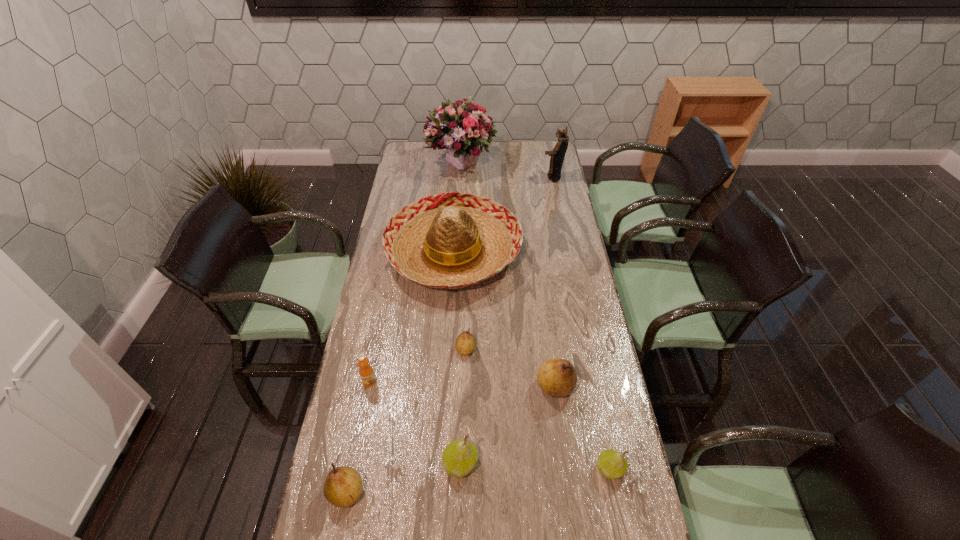
Find the location of a particular element. Image resolution: width=960 pixels, height=540 pixels. figurine positioned at the right edge is located at coordinates (558, 153).

You are a GUI agent. You are given a task and a screenshot of the screen. Output one action in this format:
    pyautogui.click(x=<x>, y=<y>)
    Task: Click on the object present at the far left corner
    
    Given the screenshot: What is the action you would take?
    pyautogui.click(x=460, y=127)

At what (x,y) coordinates should I click in order to perform the action: click on vacant area at the far edge. Please return your answer as a coordinate pair (x, y). This screenshot has width=960, height=540. Looking at the image, I should click on (521, 159).

You are a GUI agent. You are given a task and a screenshot of the screen. Output one action in this format:
    pyautogui.click(x=<x>, y=<y>)
    Task: Click on the vacant area at the left edge
    
    Given the screenshot: What is the action you would take?
    pyautogui.click(x=373, y=310)

This screenshot has width=960, height=540. In the image, there is a desktop. What are the coordinates of `free space at the right edge` in the screenshot? It's located at (533, 166).

Locate an element on the screen. The image size is (960, 540). vacant space at the far left corner is located at coordinates (406, 152).

Find the location of a particular element. The height and width of the screenshot is (540, 960). vacant space that's between the bigger green pear and the second tallest object is located at coordinates (507, 320).

Locate an element on the screen. The image size is (960, 540). empty location between the bigger green pear and the orange juice is located at coordinates (415, 422).

Locate an element on the screen. This screenshot has width=960, height=540. unoccupied position between the second nearest brown pear and the bigger green pear is located at coordinates (508, 425).

Locate an element on the screen. This screenshot has height=540, width=960. vacant area between the seventh shortest object and the bigger green pear is located at coordinates (457, 358).